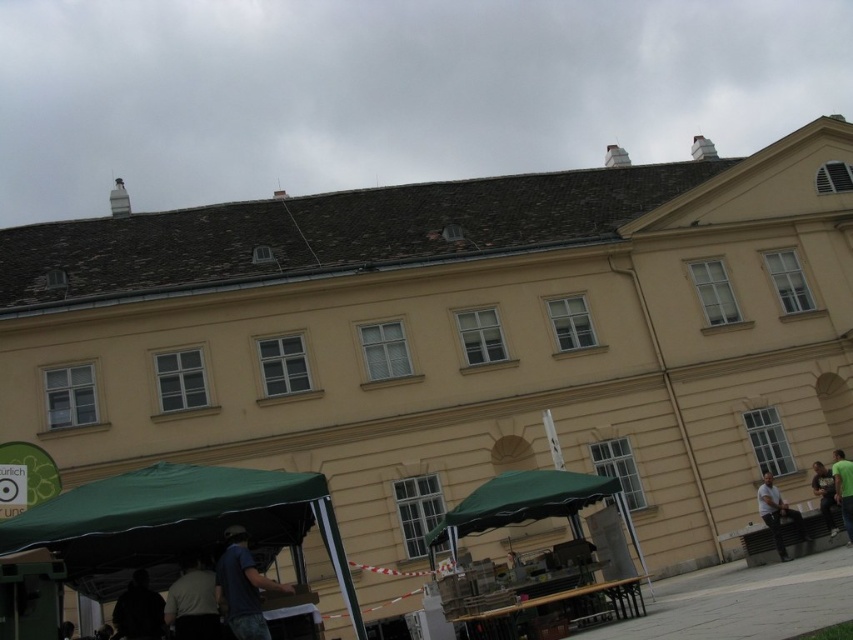
You are standing in front of the beige building and want to take a photo that includes both the point at coordinates point (x=268, y=586) and the point at coordinates point (x=172, y=624). Which point should you focus on first to ensure both are in focus?

You should focus on the point at coordinates point (x=268, y=586) first because it is closer to the camera than the point at coordinates point (x=172, y=624). This ensures that both points will be in focus as the closer point sets the focal plane.

You are planning to set up a new tent between the green fabric canopy at lower left and the green fabric umbrella at lower right. The tent requires a space of 30 meters between the two existing structures to be placed safely. Is there enough space for the new tent?

The distance between the green fabric canopy at lower left and the green fabric umbrella at lower right is 28.92 meters, which is less than the required 30 meters. Therefore, there is not enough space to safely place the new tent.

You are a photographer positioned at the entrance of the building. You see a dark blue shirt at center and a dark gray shirt at lower center. Which person is standing closer to the building?

The dark blue shirt at center has a greater height compared to the dark gray shirt at lower center, so the dark blue shirt at center is closer to the building because objects closer to the viewer appear larger.